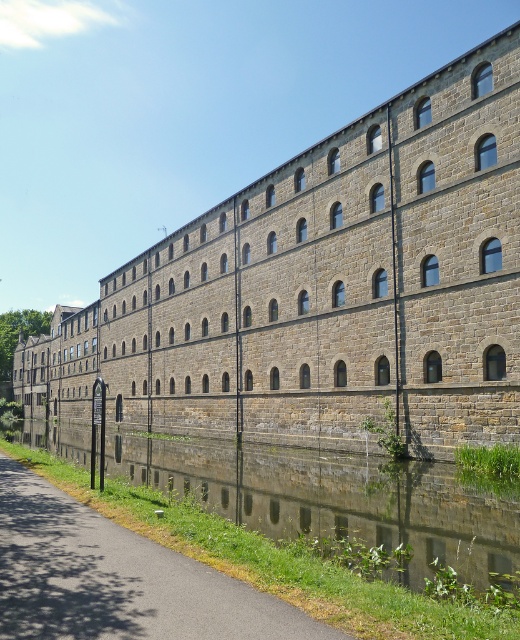
From the picture: You are standing on the smooth asphalt path at lower center and want to take a photo of the brown stone building at center. Since the path is in front of the building, will the building be visible in your photo?

The brown stone building at center is positioned over smooth asphalt path at lower center, so the building will be visible in the photo because it is elevated above the path.

You are standing on the smooth asphalt path at lower center and want to take a photo of the brown stone building at center. Since the building is much taller than the path, will you need to tilt your camera upwards to capture the entire building in the photo?

Yes, because the brown stone building at center is much taller than the smooth asphalt path at lower center, you will need to tilt your camera upwards to capture the entire building in the photo.

You are planning to take a photo of the brown stone building at center and the smooth asphalt path at lower center. Since you want both objects to be clearly visible in the frame, which object should you focus on to ensure proper focus given their sizes?

The brown stone building at center is larger in size than the smooth asphalt path at lower center, so you should focus on the brown stone building at center to ensure proper focus since larger objects require focusing on them to capture details clearly.